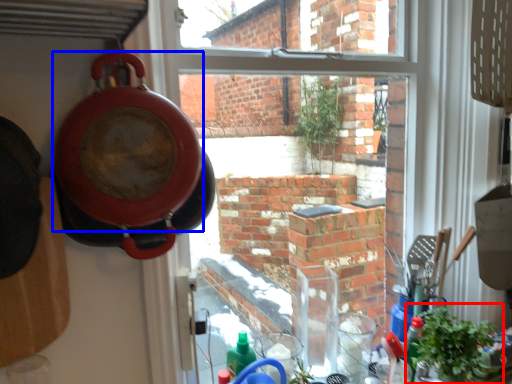
Question: Which object is closer to the camera taking this photo, houseplant (highlighted by a red box) or pizza pan (highlighted by a blue box)?

Choices:
 (A) houseplant
 (B) pizza pan

Answer: (B)